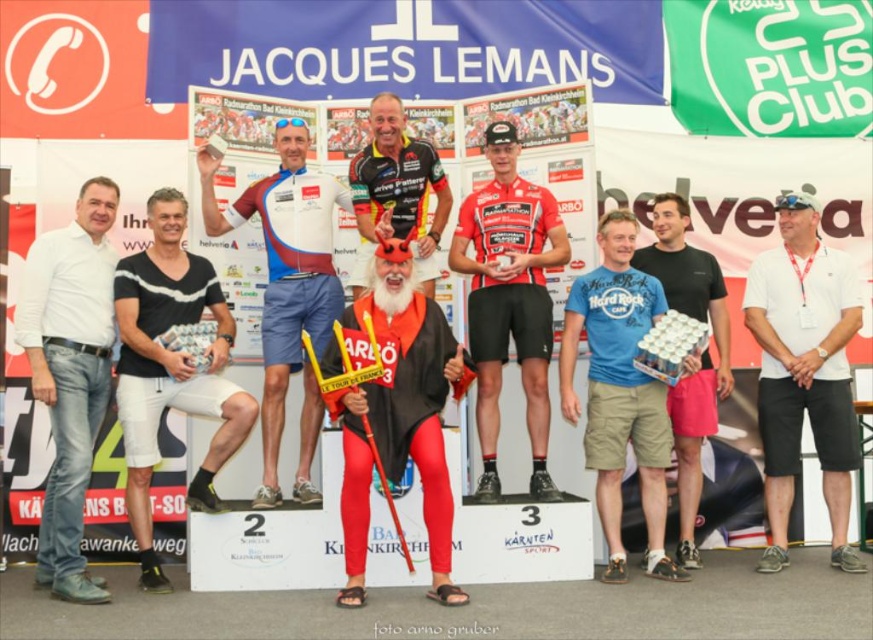
You are a photographer at the Jacques Lemans race event. You need to capture a photo of the participants on the podium. The white denim jeans at left and the black matte shorts at center are part of their outfits. Based on their positions, which participant is standing lower on the podium?

The white denim jeans at left is positioned under the black matte shorts at center, meaning the participant wearing white denim jeans at left is standing lower on the podium.

You are a photographer positioned at the back of the tent. You want to take a photo of both the white cotton polo shirt at right and the shiny black cycling jersey at center. Which one will appear larger in your photo?

The white cotton polo shirt at right is closer to the viewer than the shiny black cycling jersey at center, so it will appear larger in the photo.

What is the color of the clothing worn by the person standing at the position marked by the point coordinates (803, 371) in the image?

Answer: The person at point (803, 371) is wearing a white cotton polo shirt.